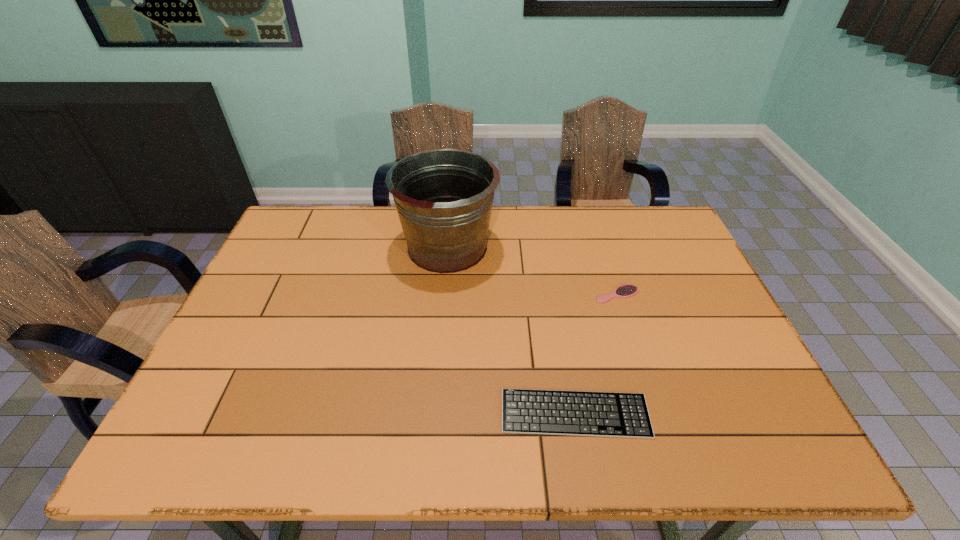
You are a GUI agent. You are given a task and a screenshot of the screen. Output one action in this format:
    pyautogui.click(x=<x>, y=<y>)
    Task: Click on the bucket
    
    Given the screenshot: What is the action you would take?
    pyautogui.click(x=444, y=197)

Locate an element on the screen. the farthest object is located at coordinates (444, 197).

Find the location of a particular element. This screenshot has height=540, width=960. the second farthest object is located at coordinates (624, 291).

What are the coordinates of `the second tallest object` in the screenshot? It's located at (624, 291).

At what (x,y) coordinates should I click in order to perform the action: click on computer keyboard. Please return your answer as a coordinate pair (x, y). Looking at the image, I should click on (552, 412).

Image resolution: width=960 pixels, height=540 pixels. I want to click on the nearest object, so click(552, 412).

In order to click on vacant point located on the right of the tallest object in this screenshot , I will do `click(558, 247)`.

Locate an element on the screen. The image size is (960, 540). free space located on the left of the second farthest object is located at coordinates (506, 294).

Image resolution: width=960 pixels, height=540 pixels. In order to click on free space located 0.260m on the right of the computer keyboard in this screenshot , I will do `click(766, 414)`.

Where is `object at the far edge`? object at the far edge is located at coordinates (444, 197).